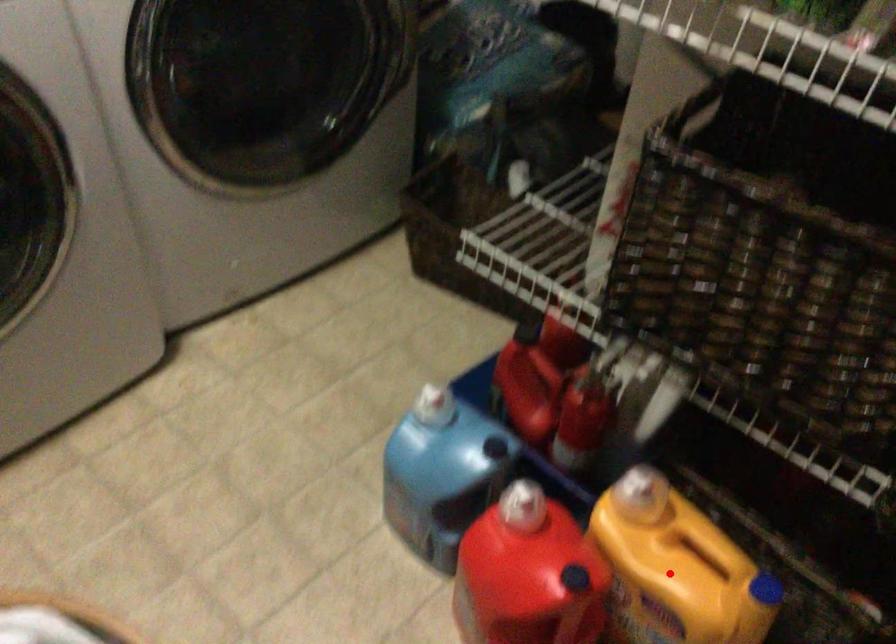
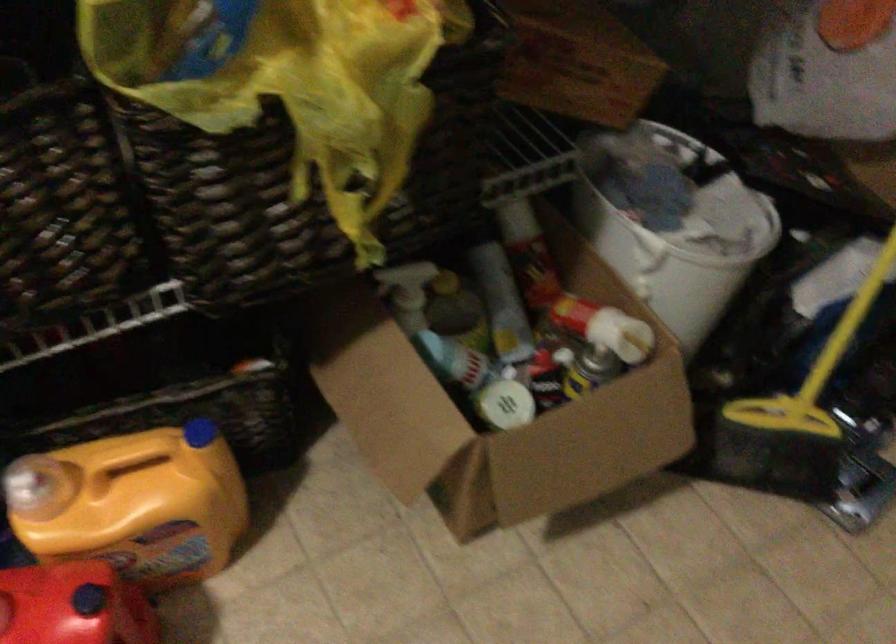
Where in the second image is the point corresponding to the highlighted location from the first image?

(133, 504)